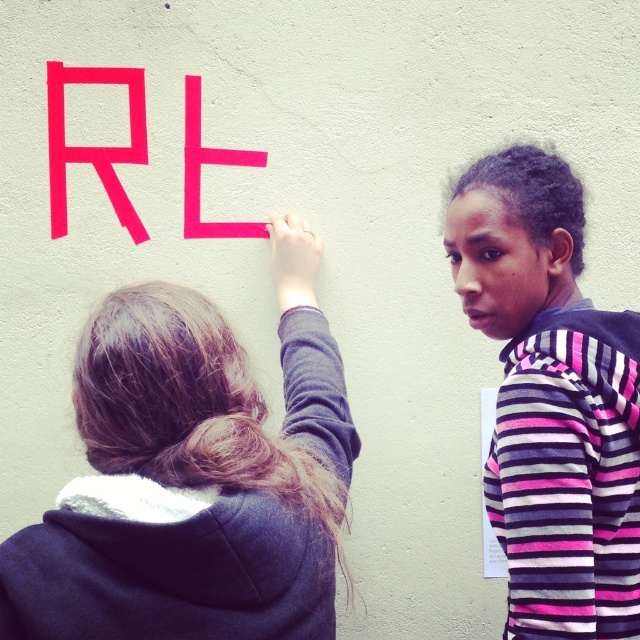
Based on the photo, you are a photographer standing 10 feet away from the wall. You want to take a photo that includes both the pink striped hoodie at upper right and the pink matte letter e at upper center. Given their distance apart, will they both fit in your camera frame which has a maximum width of 30 inches? Please explain your reasoning.

The pink striped hoodie at upper right and the pink matte letter e at upper center are 31.52 inches apart. Since the camera frame can only accommodate up to 30 inches, they will not both fit within the frame.

You are a photographer standing at the center of the image. You want to take a photo that includes both the person holding the pink letter R and the person in the pink striped hoodie at upper right. Which direction should you move to ensure both are in frame?

Since the two people are 4.32 feet apart, you should move to the center of the image and ensure your camera has a wide enough angle to capture both individuals in the frame.

You are an observer standing in front of the wall. You see the dark gray hoodie at upper left and the pink matte letter r at upper left. Which object is positioned higher on the wall?

The pink matte letter r at upper left is positioned higher than the dark gray hoodie at upper left.